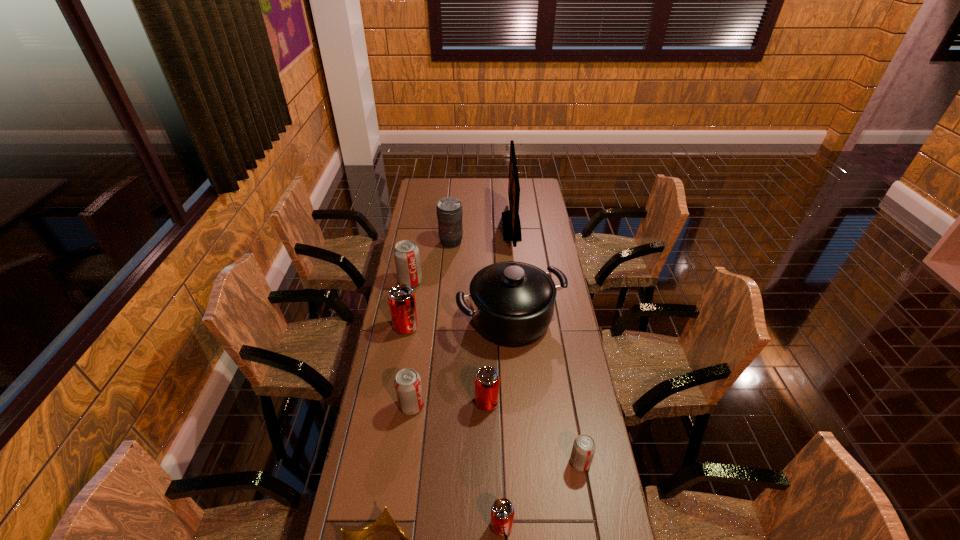
Where is `free space at the far left corner of the desktop`? The width and height of the screenshot is (960, 540). free space at the far left corner of the desktop is located at coordinates (432, 187).

At what (x,y) coordinates should I click in order to perform the action: click on free space between the saucepan and the second smallest red soda can. Please return your answer as a coordinate pair (x, y). Looking at the image, I should click on (499, 361).

The image size is (960, 540). I want to click on vacant area between the nearest red soda can and the monitor, so click(x=507, y=376).

Locate an element on the screen. The width and height of the screenshot is (960, 540). free spot between the telephoto lens and the biggest red soda can is located at coordinates (428, 285).

Locate an element on the screen. This screenshot has width=960, height=540. free point between the saucepan and the second smallest red soda can is located at coordinates (499, 361).

Find the location of a particular element. free spot between the second smallest red soda can and the rightmost soda can is located at coordinates (534, 433).

I want to click on free spot between the second farthest soda can and the second smallest red soda can, so click(446, 365).

You are a GUI agent. You are given a task and a screenshot of the screen. Output one action in this format:
    pyautogui.click(x=<x>, y=<y>)
    Task: Click on the unoccupied position between the nearest soda can and the saucepan
    
    Given the screenshot: What is the action you would take?
    pyautogui.click(x=506, y=423)

Locate which object is the ninth closest to the crown. Please provide its 2D coordinates. Your answer should be formatted as a tuple, i.e. [(x, y)], where the tuple contains the x and y coordinates of a point satisfying the conditions above.

[(449, 210)]

Point out which object is positioned as the second nearest to the leftmost red soda can. Please provide its 2D coordinates. Your answer should be formatted as a tuple, i.e. [(x, y)], where the tuple contains the x and y coordinates of a point satisfying the conditions above.

[(406, 253)]